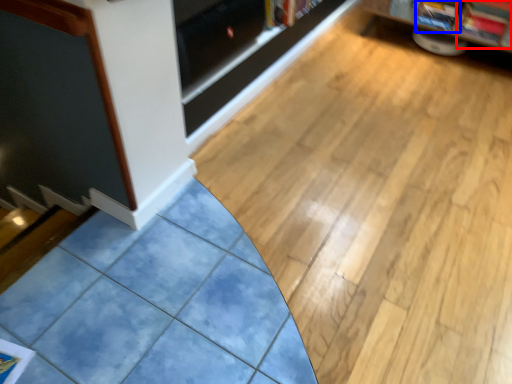
Question: Which point is closer to the camera, magazine (highlighted by a red box) or magazine (highlighted by a blue box)?

Choices:
 (A) magazine
 (B) magazine

Answer: (A)